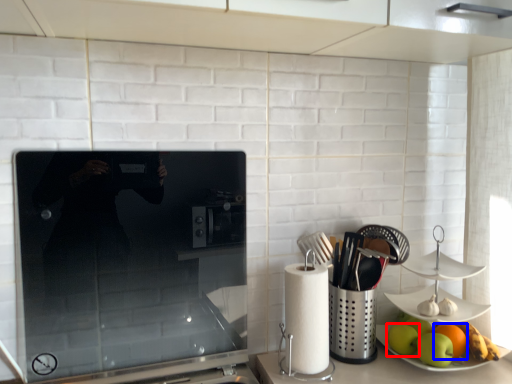
Question: Which object is closer to the camera taking this photo, apple (highlighted by a red box) or orange (highlighted by a blue box)?

Choices:
 (A) apple
 (B) orange

Answer: (B)